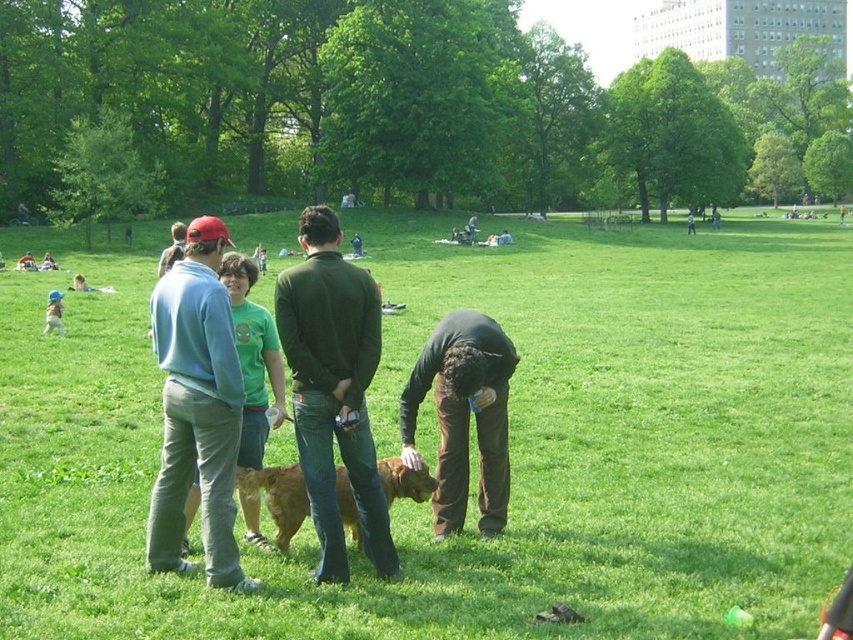
Can you confirm if green matte shirt at center is positioned above light blue sweatshirt at left?

Yes, green matte shirt at center is above light blue sweatshirt at left.

Which is in front, point (358, 348) or point (209, 312)?

Point (209, 312) is more forward.

Find the location of `green matte shirt at center`. green matte shirt at center is located at coordinates (334, 388).

Which is below, green matte shirt at center or brown cotton pants at center?

brown cotton pants at center is below.

Can you confirm if green matte shirt at center is taller than brown cotton pants at center?

Indeed, green matte shirt at center has a greater height compared to brown cotton pants at center.

Is point (360, 460) farther from viewer compared to point (456, 340)?

No, it is not.

I want to click on green matte shirt at center, so click(334, 388).

Who is taller, green grassy field at center or light blue sweatshirt at left?

green grassy field at center is taller.

This screenshot has height=640, width=853. Describe the element at coordinates (474, 442) in the screenshot. I see `green grassy field at center` at that location.

Find the location of a particular element. Image resolution: width=853 pixels, height=640 pixels. green grassy field at center is located at coordinates (474, 442).